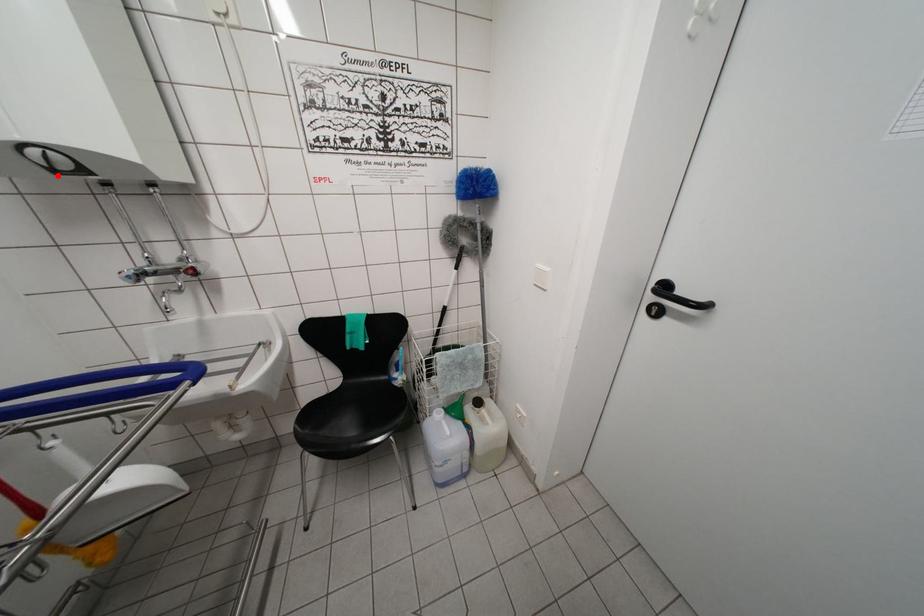
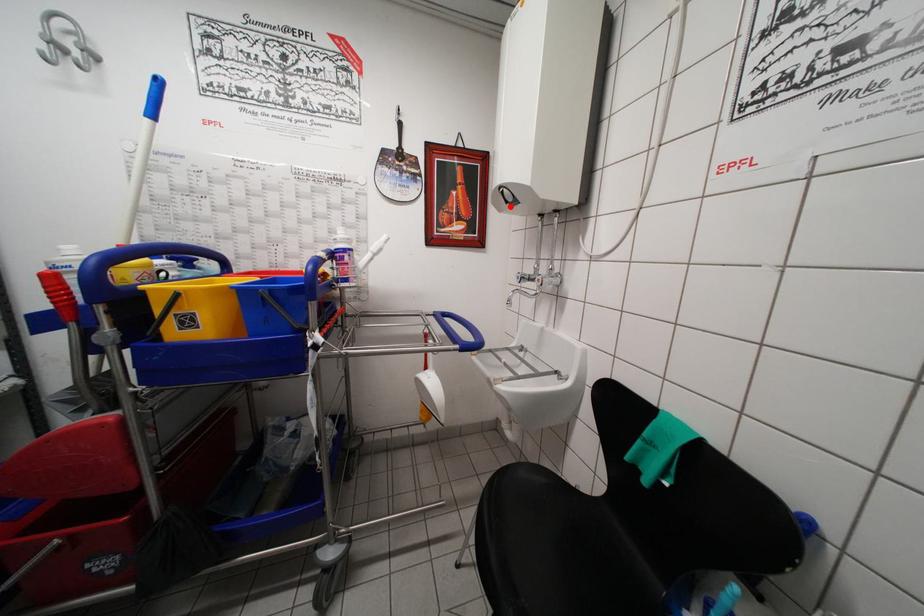
I am providing you with two images of the same scene from different viewpoints. A red point is marked on the first image and another point is marked on the second image. Is the marked point in image1 the same physical position as the marked point in image2?

Yes